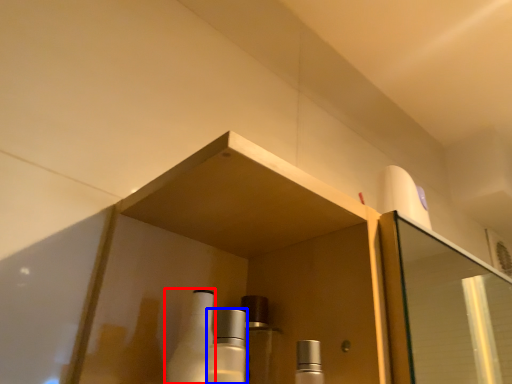
Question: Among these objects, which one is nearest to the camera, bottle (highlighted by a red box) or mouthwash (highlighted by a blue box)?

Choices:
 (A) bottle
 (B) mouthwash

Answer: (B)